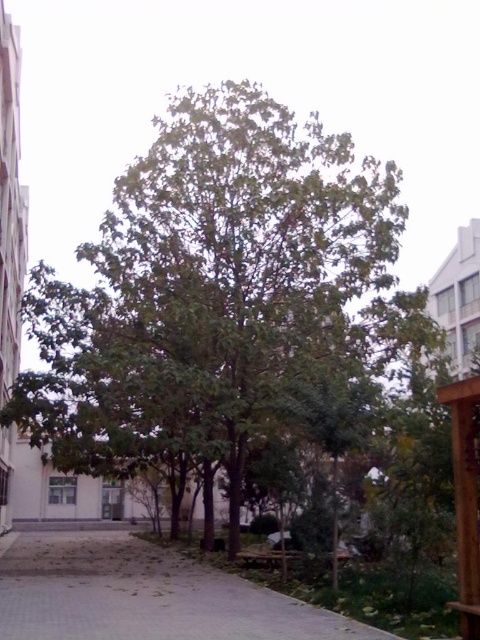
You are planning to plant a new tree in your backyard and want to ensure it has enough space. You see the green leafy tree at center and the gray concrete pavement at lower center in the image. Which object takes up more space in the scene?

The green leafy tree at center has a larger size compared to the gray concrete pavement at lower center, so it takes up more space in the scene.

You are standing on the gray concrete pavement at lower center and looking up at the green leafy tree at center. Which object is taller?

The green leafy tree at center is taller than the gray concrete pavement at lower center.